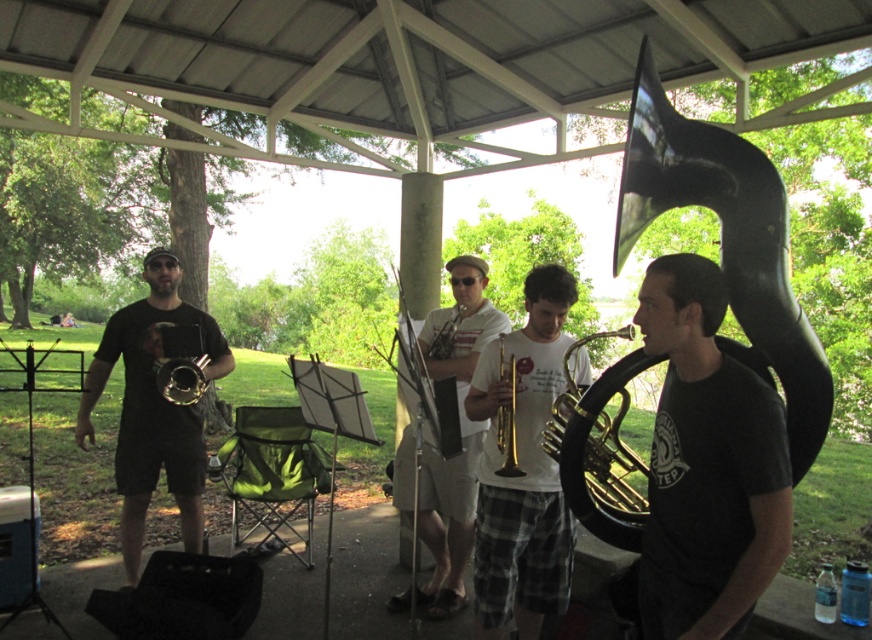
You are a photographer trying to capture a photo of the black matte tuba at right and the gold brass trumpet at left. Based on their positions, which instrument should you focus on first if you want to include both in the frame without moving the camera?

The black matte tuba at right is located below the gold brass trumpet at left, so you should focus on the gold brass trumpet at left first to ensure both are in the frame.

You are a photographer standing in the park and want to take a photo of the black polished tuba at right and the matte gold trumpet at center. Which instrument should you focus on first if you want to capture both in the same frame without moving your camera?

The black polished tuba at right is shorter than the matte gold trumpet at center, so you should focus on the matte gold trumpet at center first as it is taller and might require more attention to fit in the frame properly.